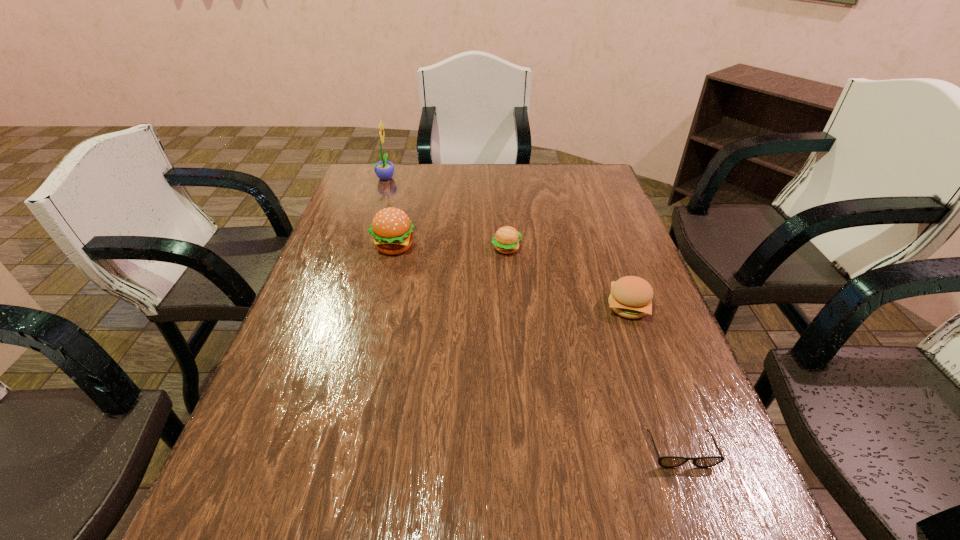
Find the location of `object located at the far left corner`. object located at the far left corner is located at coordinates (384, 170).

Find the location of a particular element. This screenshot has height=540, width=960. free space at the far edge of the desktop is located at coordinates (555, 175).

At what (x,y) coordinates should I click in order to perform the action: click on free space at the near edge of the desktop. Please return your answer as a coordinate pair (x, y). Looking at the image, I should click on (437, 536).

This screenshot has height=540, width=960. I want to click on vacant space at the left edge of the desktop, so click(330, 274).

Find the location of a particular element. vacant point at the right edge is located at coordinates (605, 286).

Image resolution: width=960 pixels, height=540 pixels. In the image, there is a desktop. Find the location of `free region at the far left corner`. free region at the far left corner is located at coordinates click(402, 165).

Where is `vacant area at the far right corner of the desktop`? This screenshot has width=960, height=540. vacant area at the far right corner of the desktop is located at coordinates (595, 186).

Find the location of a particular element. The image size is (960, 540). free space that is in between the second tallest object and the third object from right to left is located at coordinates (450, 247).

Identify the location of vacant area that lies between the leftmost hamburger and the second hamburger from right to left. The height and width of the screenshot is (540, 960). (450, 247).

Identify the location of vacant area between the second shortest object and the third tallest object. (567, 278).